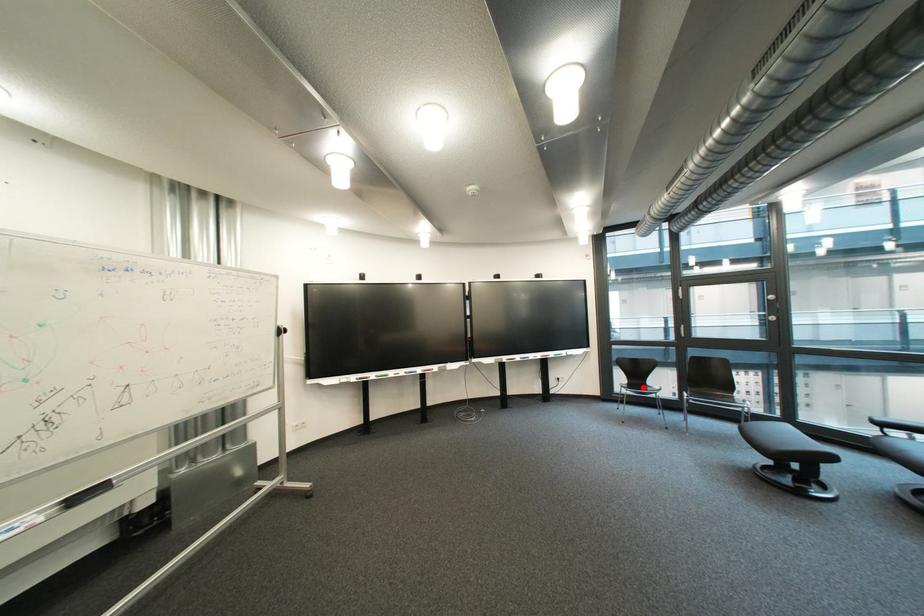
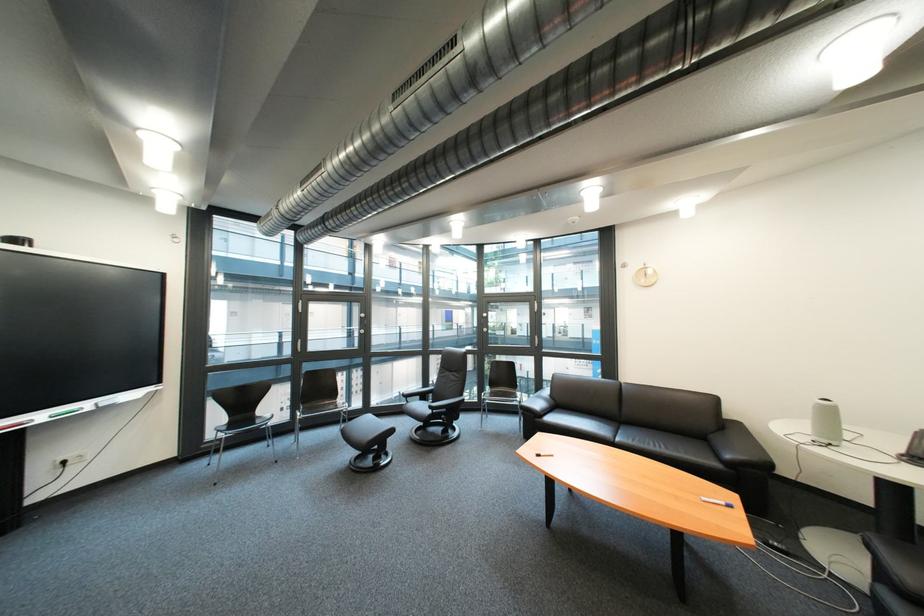
In the second image, find the point that corresponds to the highlighted location in the first image.

(246, 426)